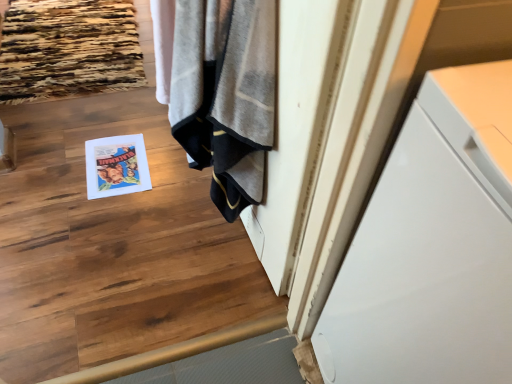
Question: In terms of height, does matte paper magazine at center look taller or shorter compared to white glossy cabinet at right?

Choices:
 (A) short
 (B) tall

Answer: (A)

Question: From a real-world perspective, relative to white glossy cabinet at right, is matte paper magazine at center vertically above or below?

Choices:
 (A) above
 (B) below

Answer: (B)

Question: Estimate the real-world distances between objects in this image. Which object is closer to the gray textured towel at center?

Choices:
 (A) matte paper magazine at center
 (B) white glossy cabinet at right

Answer: (B)

Question: Which object is the closest to the gray textured towel at center?

Choices:
 (A) white glossy cabinet at right
 (B) matte paper magazine at center

Answer: (A)